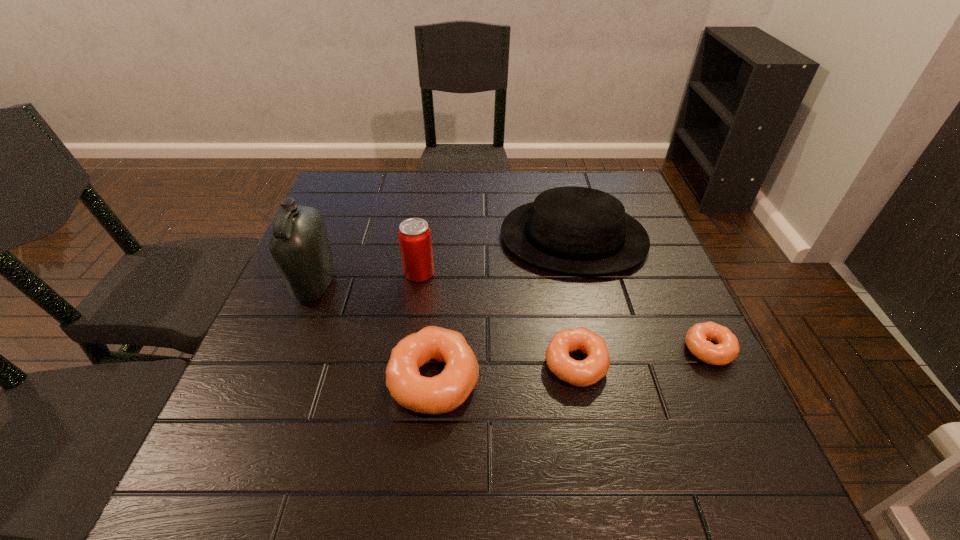
Locate an element on the screen. unoccupied area between the shortest object and the fedora is located at coordinates (641, 293).

The height and width of the screenshot is (540, 960). I want to click on vacant space that's between the fedora and the bottle, so click(x=444, y=261).

You are a GUI agent. You are given a task and a screenshot of the screen. Output one action in this format:
    pyautogui.click(x=<x>, y=<y>)
    Task: Click on the unoccupied position between the fifth shortest object and the fedora
    This screenshot has height=540, width=960.
    Given the screenshot: What is the action you would take?
    pyautogui.click(x=496, y=255)

This screenshot has height=540, width=960. I want to click on free spot between the fourth tallest object and the fedora, so click(504, 309).

The height and width of the screenshot is (540, 960). I want to click on vacant space in between the second tallest object and the fourth shortest object, so click(x=496, y=255).

In order to click on empty space between the fedora and the leftmost object in this screenshot , I will do `click(444, 261)`.

Locate an element on the screen. The image size is (960, 540). free space between the fifth tallest object and the fedora is located at coordinates (574, 301).

Point out which object is positioned as the second nearest to the leftmost doughnut. Please provide its 2D coordinates. Your answer should be formatted as a tuple, i.e. [(x, y)], where the tuple contains the x and y coordinates of a point satisfying the conditions above.

[(414, 234)]

Identify which object is the second closest to the second doughnut from left to right. Please provide its 2D coordinates. Your answer should be formatted as a tuple, i.e. [(x, y)], where the tuple contains the x and y coordinates of a point satisfying the conditions above.

[(727, 348)]

Identify which doughnut is located as the nearest to the third tallest object. Please provide its 2D coordinates. Your answer should be formatted as a tuple, i.e. [(x, y)], where the tuple contains the x and y coordinates of a point satisfying the conditions above.

[(727, 348)]